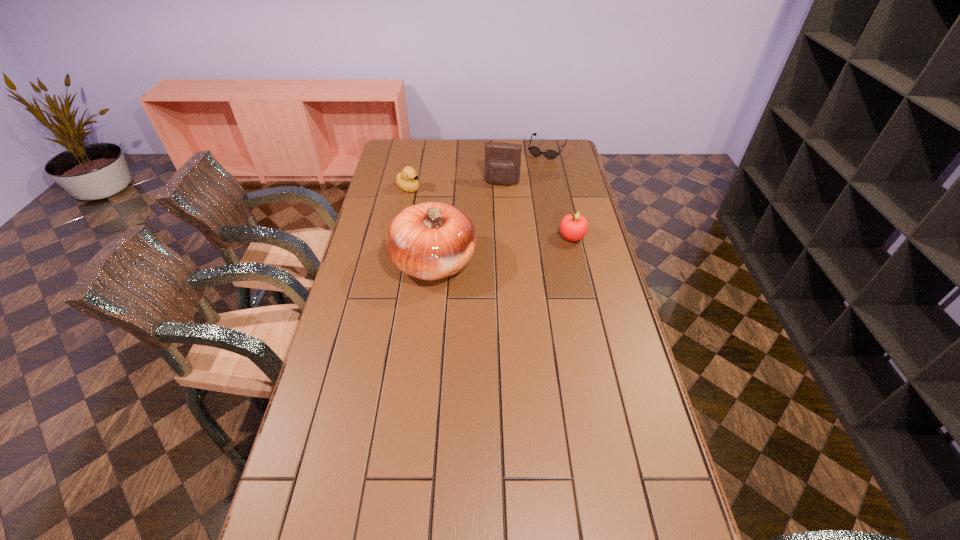
The height and width of the screenshot is (540, 960). Find the location of `vacant area located with an open flap on the pouch`. vacant area located with an open flap on the pouch is located at coordinates (490, 244).

The image size is (960, 540). Find the location of `vacant region located with an open flap on the pouch`. vacant region located with an open flap on the pouch is located at coordinates (490, 244).

The width and height of the screenshot is (960, 540). What are the coordinates of `free space located on the face of the duckling` in the screenshot? It's located at (446, 208).

Identify the location of free location located 0.320m on the face of the duckling. (474, 223).

Locate an element on the screen. This screenshot has height=540, width=960. vacant position located on the face of the duckling is located at coordinates (453, 212).

Locate an element on the screen. The height and width of the screenshot is (540, 960). free space located on the lenses of the farthest object is located at coordinates (531, 181).

The image size is (960, 540). Find the location of `free spot located 0.270m on the lenses of the farthest object`. free spot located 0.270m on the lenses of the farthest object is located at coordinates (525, 191).

Locate an element on the screen. blank space located 0.190m on the lenses of the farthest object is located at coordinates (531, 181).

Locate an element on the screen. object situated at the far edge is located at coordinates (535, 151).

Locate an element on the screen. Image resolution: width=960 pixels, height=540 pixels. pumpkin at the left edge is located at coordinates (430, 241).